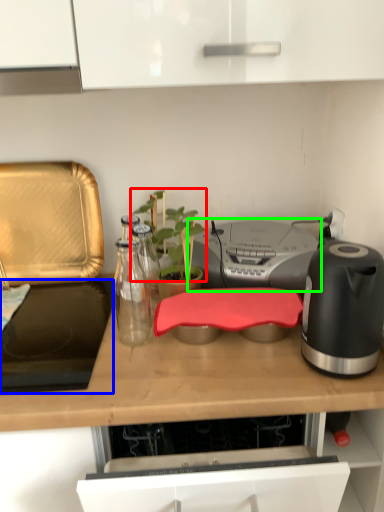
Question: Considering the real-world distances, which object is farthest from plant (highlighted by a red box)? gas stove (highlighted by a blue box) or stereo (highlighted by a green box)?

Choices:
 (A) gas stove
 (B) stereo

Answer: (A)